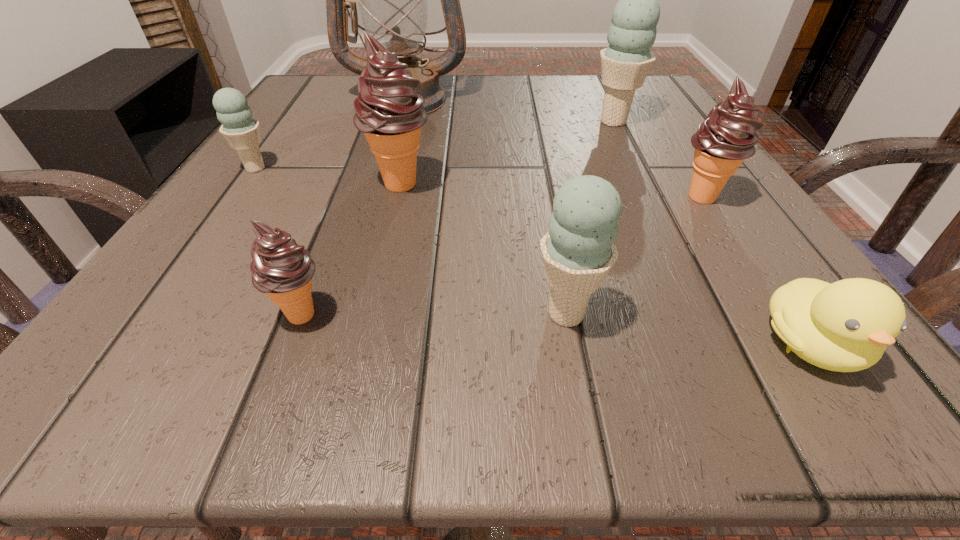
Locate an element on the screen. The width and height of the screenshot is (960, 540). the smallest chocolate icecream is located at coordinates (283, 270).

Locate an element on the screen. Image resolution: width=960 pixels, height=540 pixels. duckling is located at coordinates (845, 326).

At what (x,y) coordinates should I click in order to perform the action: click on yellow duckling. Please return your answer as a coordinate pair (x, y). The height and width of the screenshot is (540, 960). Looking at the image, I should click on (845, 326).

Locate an element on the screen. Image resolution: width=960 pixels, height=540 pixels. vacant region located 0.340m on the right of the tallest object is located at coordinates (634, 99).

Where is `free region located 0.090m on the front of the farthest blue ice cream`? Image resolution: width=960 pixels, height=540 pixels. free region located 0.090m on the front of the farthest blue ice cream is located at coordinates (632, 158).

I want to click on vacant space located 0.310m on the front of the biggest chocolate icecream, so click(350, 391).

Find the location of a particular element. The height and width of the screenshot is (540, 960). free location located on the left of the rightmost chocolate icecream is located at coordinates (484, 197).

Where is `vacant space situated on the back of the second blue ice cream from left to right`? The image size is (960, 540). vacant space situated on the back of the second blue ice cream from left to right is located at coordinates (542, 186).

Where is `blank space located 0.120m on the back of the second farthest blue ice cream`? blank space located 0.120m on the back of the second farthest blue ice cream is located at coordinates (285, 127).

Identify the location of vacant space located on the right of the nearest chocolate icecream. (576, 314).